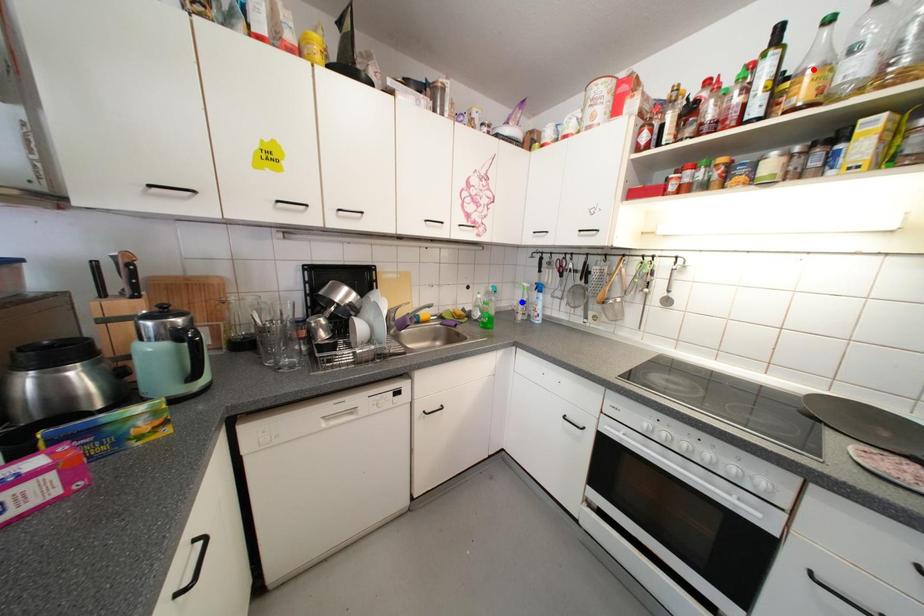
Question: Two points are marked on the image. Which point is closer to the camera?

Choices:
 (A) Blue point is closer.
 (B) Red point is closer.

Answer: (B)